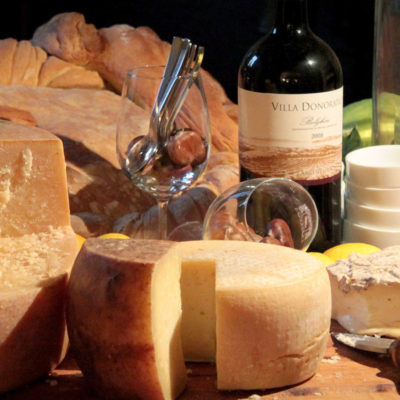
Find the location of a particular element. bottle is located at coordinates tap(332, 196).